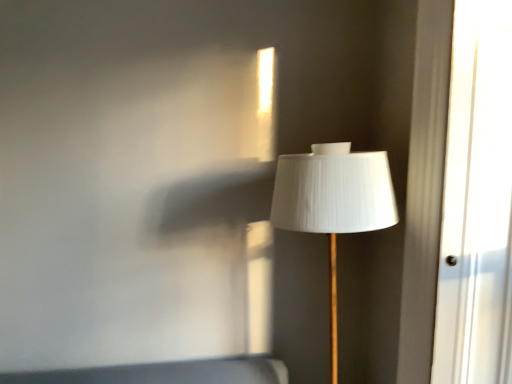
Measure the distance between point (x=291, y=191) and camera.

Point (x=291, y=191) and camera are 4.80 feet apart from each other.

Describe the element at coordinates (333, 203) in the screenshot. I see `white ribbed fabric lampshade at center` at that location.

In order to click on white ribbed fabric lampshade at center in this screenshot , I will do `click(333, 203)`.

This screenshot has width=512, height=384. What are the coordinates of `white ribbed fabric lampshade at center` in the screenshot? It's located at (333, 203).